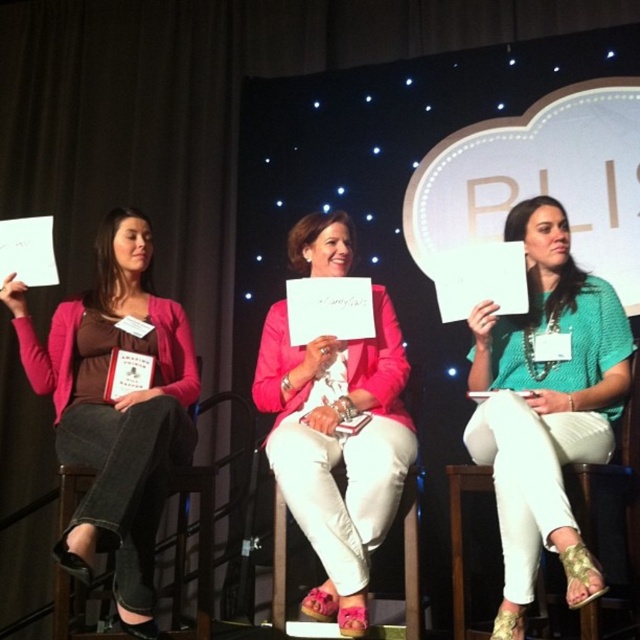
Question: Which of the following is the closest to the observer?

Choices:
 (A) matte pink sweater at left
 (B) green knitted sweater at center

Answer: (B)

Question: From the image, what is the correct spatial relationship of matte pink sweater at left in relation to pink fabric jacket at center?

Choices:
 (A) right
 (B) left

Answer: (B)

Question: Which object appears farthest from the camera in this image?

Choices:
 (A) green knitted sweater at center
 (B) pink fabric jacket at center
 (C) denim fabric chair at left

Answer: (C)

Question: Which of the following is the farthest from the observer?

Choices:
 (A) green knitted sweater at center
 (B) denim fabric chair at left

Answer: (B)

Question: Is pink fabric jacket at center wider than denim fabric chair at left?

Choices:
 (A) yes
 (B) no

Answer: (B)

Question: Can you confirm if green knitted sweater at center is positioned to the left of pink fabric jacket at center?

Choices:
 (A) yes
 (B) no

Answer: (B)